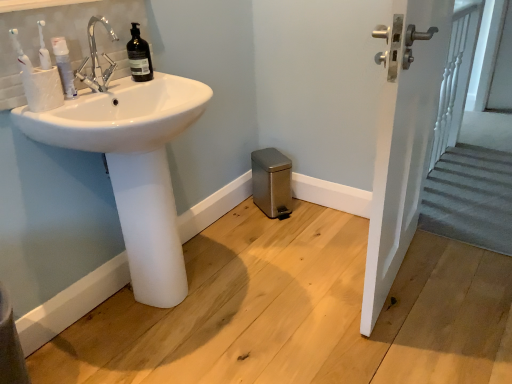
Question: Does white glossy sink at left come behind white textured cup at left?

Choices:
 (A) no
 (B) yes

Answer: (A)

Question: Does white glossy sink at left have a lesser width compared to white textured cup at left?

Choices:
 (A) no
 (B) yes

Answer: (A)

Question: Is white glossy sink at left smaller than white textured cup at left?

Choices:
 (A) yes
 (B) no

Answer: (B)

Question: Is white glossy sink at left closer to camera compared to white textured cup at left?

Choices:
 (A) yes
 (B) no

Answer: (A)

Question: Are white glossy sink at left and white textured cup at left far apart?

Choices:
 (A) yes
 (B) no

Answer: (B)

Question: Is white glossy door handle at upper right inside the boundaries of satin silver trash can at lower center, or outside?

Choices:
 (A) inside
 (B) outside

Answer: (B)

Question: Considering the positions of white glossy door handle at upper right and satin silver trash can at lower center in the image, is white glossy door handle at upper right taller or shorter than satin silver trash can at lower center?

Choices:
 (A) tall
 (B) short

Answer: (A)

Question: In the image, is white glossy door handle at upper right positioned in front of or behind satin silver trash can at lower center?

Choices:
 (A) front
 (B) behind

Answer: (A)

Question: Would you say white glossy door handle at upper right is to the left or to the right of satin silver trash can at lower center in the picture?

Choices:
 (A) left
 (B) right

Answer: (B)

Question: From the image's perspective, is white glossy sink at left positioned above or below white textured cup at left?

Choices:
 (A) above
 (B) below

Answer: (B)

Question: Considering their positions, is white glossy sink at left located in front of or behind white textured cup at left?

Choices:
 (A) behind
 (B) front

Answer: (B)

Question: Is white glossy sink at left taller or shorter than white textured cup at left?

Choices:
 (A) tall
 (B) short

Answer: (A)

Question: Does point (172, 230) appear closer or farther from the camera than point (31, 102)?

Choices:
 (A) farther
 (B) closer

Answer: (A)

Question: Considering the relative positions of white matte toothpaste tube at left and white glossy door handle at upper right in the image provided, is white matte toothpaste tube at left to the left or to the right of white glossy door handle at upper right?

Choices:
 (A) left
 (B) right

Answer: (A)

Question: Is white matte toothpaste tube at left situated inside white glossy door handle at upper right or outside?

Choices:
 (A) inside
 (B) outside

Answer: (B)